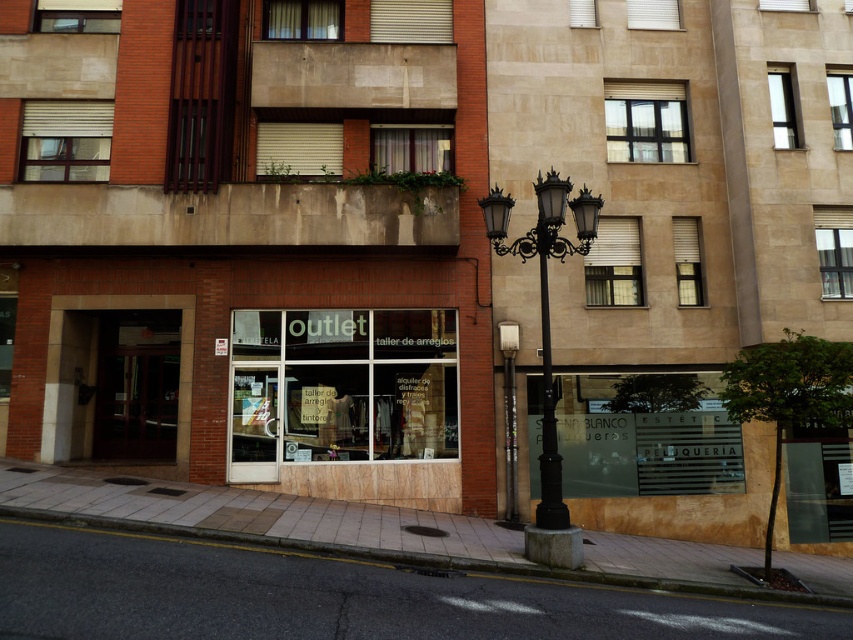
Question: Is gray concrete curb at lower left thinner than black wrought iron pole at center?

Choices:
 (A) no
 (B) yes

Answer: (A)

Question: Which object is positioned closest to the black wrought iron streetlight at center?

Choices:
 (A) black metal streetlight at center
 (B) gray concrete curb at lower left
 (C) transparent glass outlet at center

Answer: (A)

Question: Does transparent glass outlet at center have a greater width compared to black wrought iron pole at center?

Choices:
 (A) yes
 (B) no

Answer: (A)

Question: Does black metal streetlight at center appear over black wrought iron pole at center?

Choices:
 (A) yes
 (B) no

Answer: (A)

Question: Which object is farther from the camera taking this photo?

Choices:
 (A) transparent glass outlet at center
 (B) black metal streetlight at center

Answer: (A)

Question: Which object is the closest to the gray concrete curb at lower left?

Choices:
 (A) black metal streetlight at center
 (B) transparent glass outlet at center
 (C) black wrought iron streetlight at center

Answer: (B)